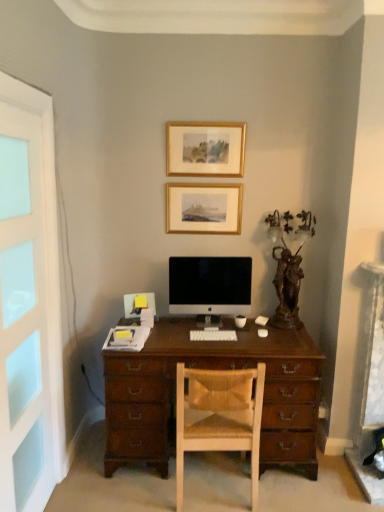
This screenshot has width=384, height=512. What are the coordinates of `empty space that is ontop of gold/glossy picture frame at upper center, which appears as the 1th picture frame when viewed from the top (from a real-world perspective)` in the screenshot? It's located at (215, 116).